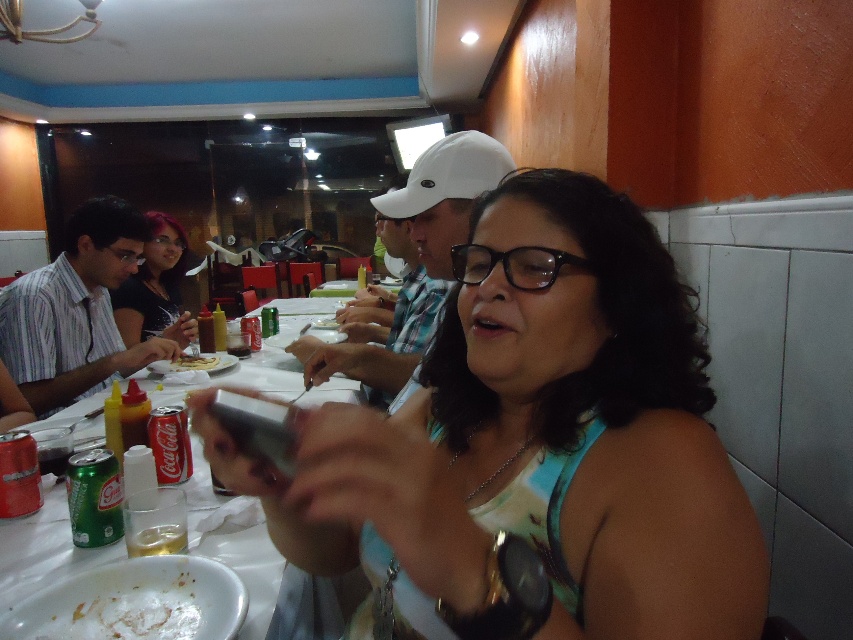
You are a server at the restaurant and need to place a large platter between the matte green tank top at center and the striped fabric shirt at left. Based on the description, which side of the platter should you align closer to the wider object?

The matte green tank top at center is wider than the striped fabric shirt at left, so align the platter closer to the matte green tank top at center to accommodate its width.

You are a server at a restaurant and need to place a 15 cm long utensil set between the white paper table at center and the yellowish matte bread at center. Will there be enough space?

The distance between the white paper table at center and the yellowish matte bread at center is 16.77 centimeters. Since the utensil set is 15 cm long, there will be enough space to place it between them.